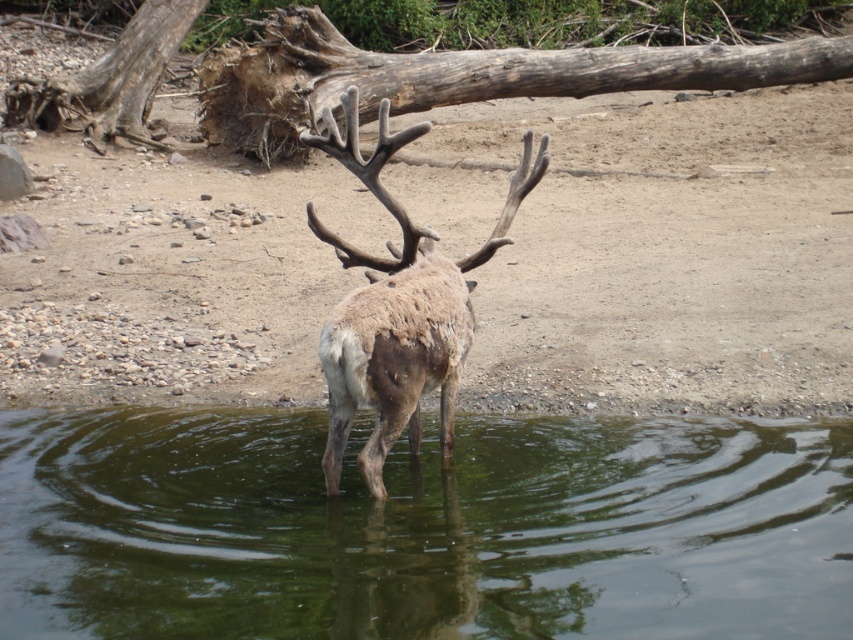
Question: Is green reflective water at center behind brown fuzzy antlered deer at center?

Choices:
 (A) yes
 (B) no

Answer: (B)

Question: Is green reflective water at center smaller than brown fuzzy antlered deer at center?

Choices:
 (A) no
 (B) yes

Answer: (A)

Question: Which point is closer to the camera?

Choices:
 (A) brown fuzzy antlered deer at center
 (B) green reflective water at center

Answer: (B)

Question: Is green reflective water at center behind brown fuzzy antlered deer at center?

Choices:
 (A) yes
 (B) no

Answer: (B)